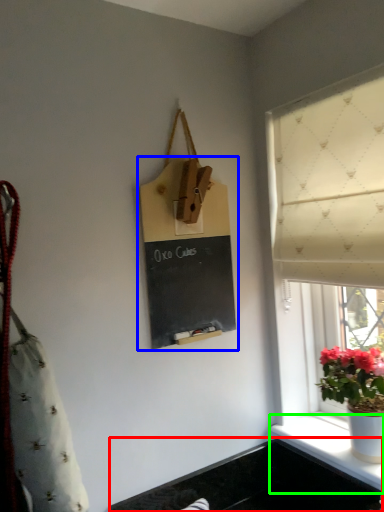
Question: Which is nearer to the sink (highlighted by a red box)? bulletin board (highlighted by a blue box) or window sill (highlighted by a green box).

Choices:
 (A) bulletin board
 (B) window sill

Answer: (B)